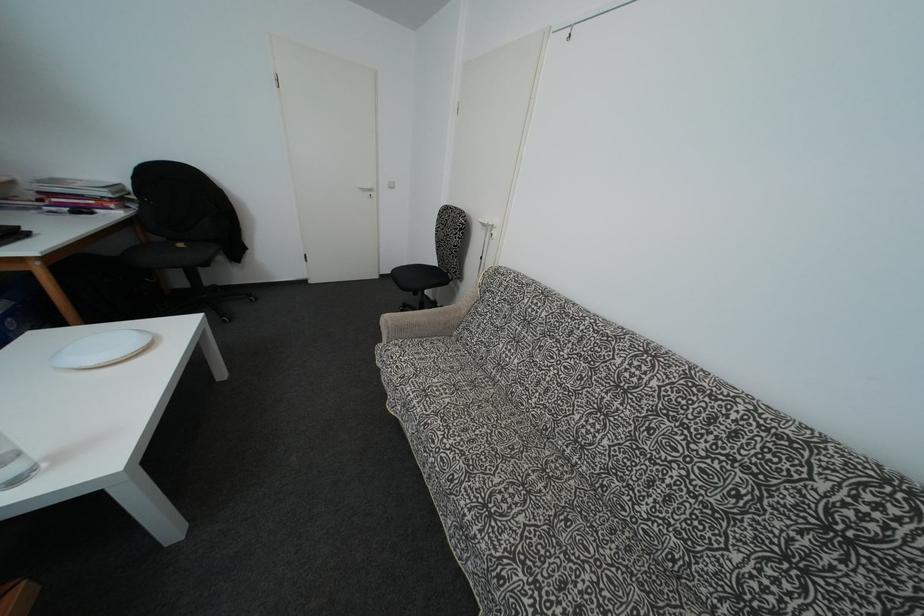
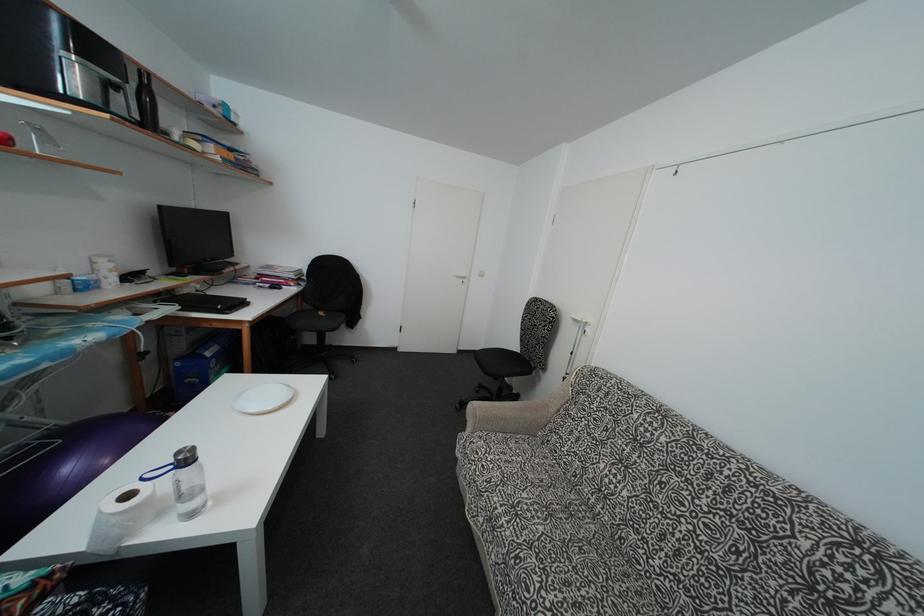
Locate, in the second image, the point that corresponds to point (185, 252) in the first image.

(325, 320)